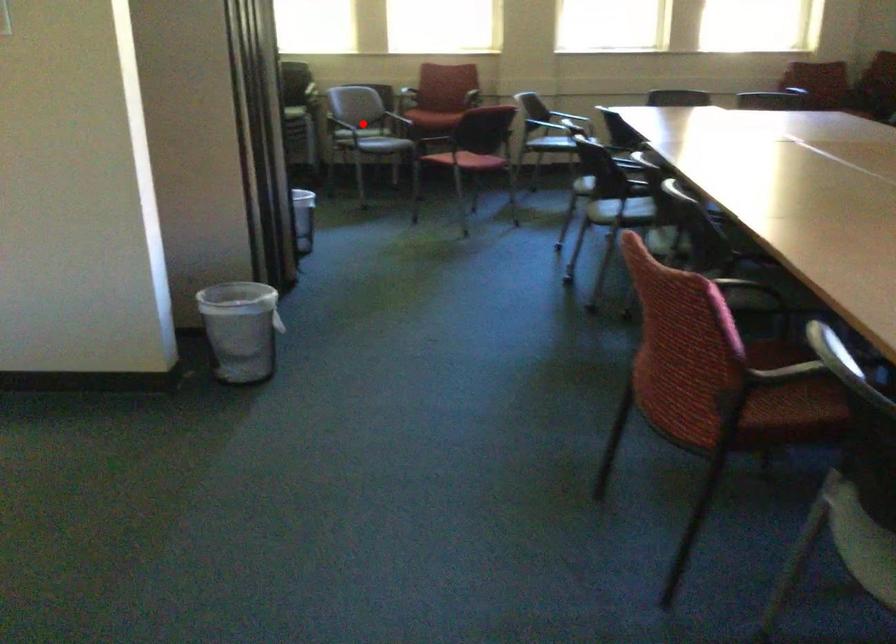
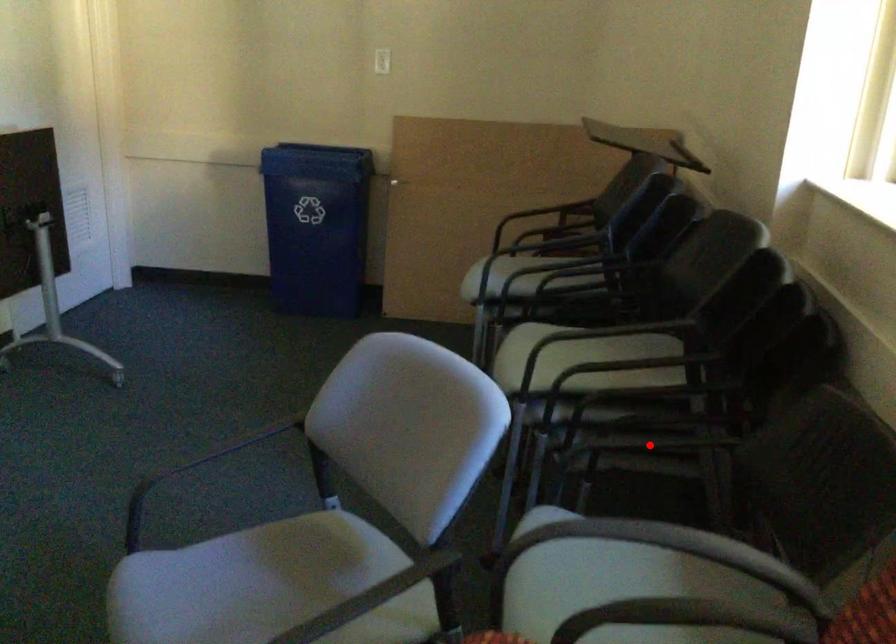
I am providing you with two images of the same scene from different viewpoints. A red point is marked on the first image and another point is marked on the second image. Does the point marked in image1 correspond to the same location as the one in image2?

No